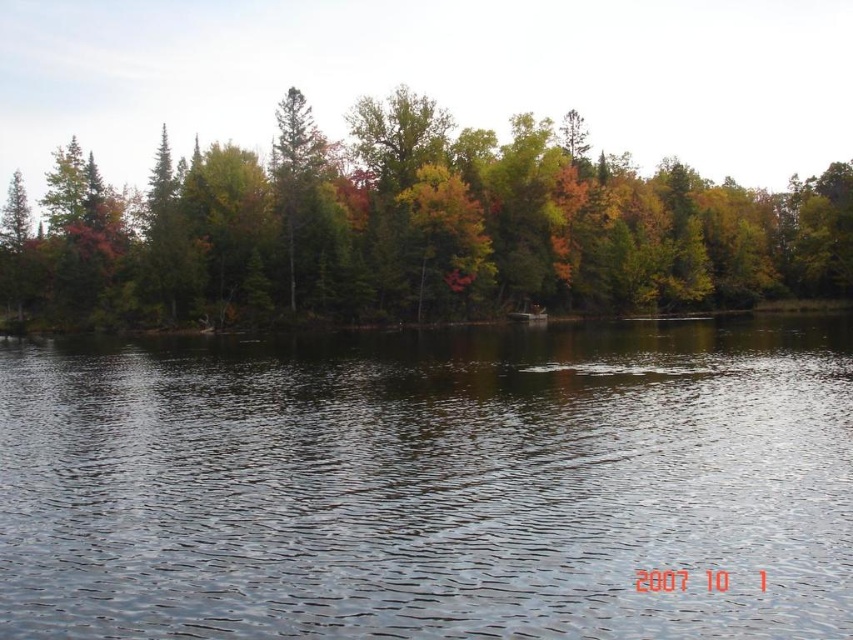
Does transparent water at center appear on the left side of green matte tree at center?

In fact, transparent water at center is to the right of green matte tree at center.

Does transparent water at center appear on the right side of green matte tree at center?

Indeed, transparent water at center is positioned on the right side of green matte tree at center.

Which is behind, point (199, 476) or point (164, 221)?

The point (164, 221) is behind.

What are the coordinates of `transparent water at center` in the screenshot? It's located at (431, 484).